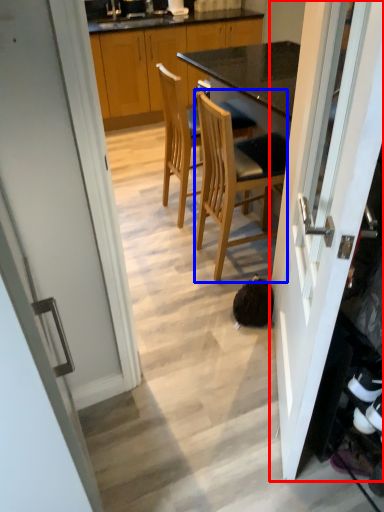
Question: Which object is closer to the camera taking this photo, door (highlighted by a red box) or chair (highlighted by a blue box)?

Choices:
 (A) door
 (B) chair

Answer: (A)